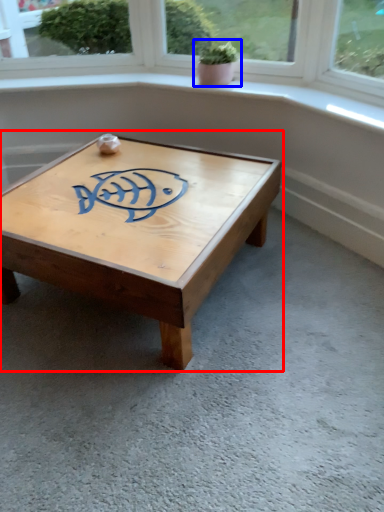
Question: Which object appears farthest to the camera in this image, coffee table (highlighted by a red box) or houseplant (highlighted by a blue box)?

Choices:
 (A) coffee table
 (B) houseplant

Answer: (B)